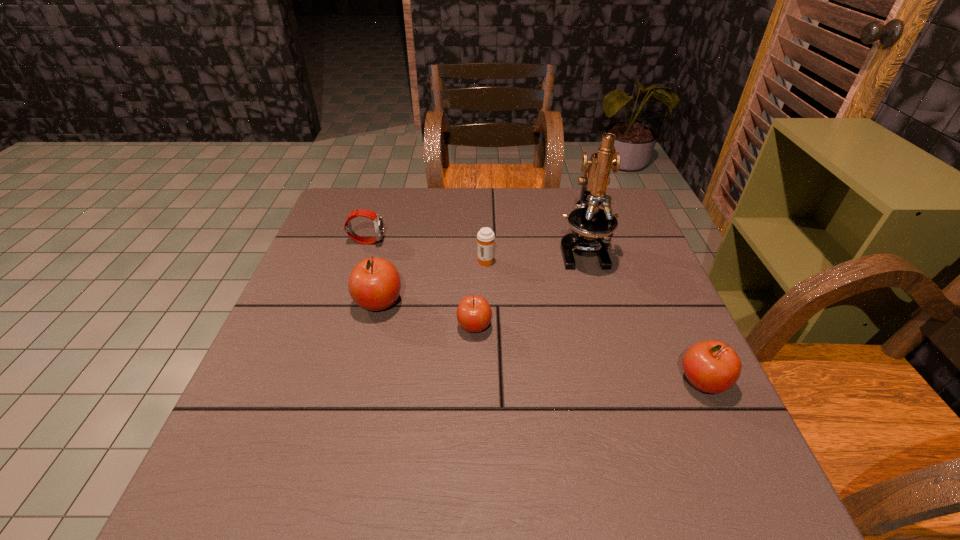
Find the location of a particular element. vacant space that is in between the microscope and the second apple from right to left is located at coordinates (528, 288).

This screenshot has height=540, width=960. In order to click on free space between the tallest object and the nearest object in this screenshot , I will do `click(642, 316)`.

In order to click on free point between the tallest object and the tallest apple in this screenshot , I will do `click(481, 277)`.

The width and height of the screenshot is (960, 540). I want to click on empty space between the tallest object and the nearest apple, so click(x=642, y=316).

Image resolution: width=960 pixels, height=540 pixels. Identify the location of vacant space that is in between the shortest apple and the microscope. (528, 288).

Choose which object is the fifth nearest neighbor to the fifth shortest object. Please provide its 2D coordinates. Your answer should be formatted as a tuple, i.e. [(x, y)], where the tuple contains the x and y coordinates of a point satisfying the conditions above.

[(712, 366)]

Identify the location of object that stands as the second closest to the medicine. [x=474, y=314].

You are a GUI agent. You are given a task and a screenshot of the screen. Output one action in this format:
    pyautogui.click(x=<x>, y=<y>)
    Task: Click on the closest apple to the rightmost apple
    
    Given the screenshot: What is the action you would take?
    pyautogui.click(x=474, y=314)

The width and height of the screenshot is (960, 540). Find the location of `apple that is the closest one to the microscope`. apple that is the closest one to the microscope is located at coordinates (474, 314).

Where is `free space that satisfies the following two spatial constraints: 1. on the face of the second apple from left to right; 2. on the left side of the watch`? free space that satisfies the following two spatial constraints: 1. on the face of the second apple from left to right; 2. on the left side of the watch is located at coordinates (339, 327).